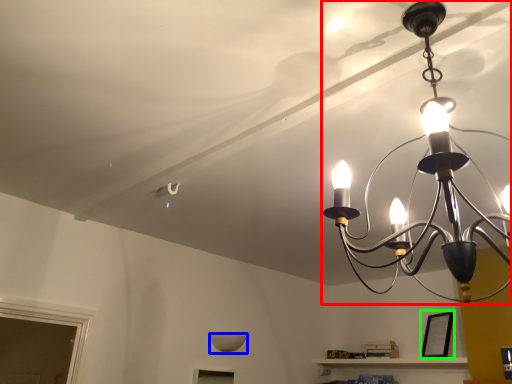
Question: Estimate the real-world distances between objects in this image. Which object is closer to lamp (highlighted by a red box), lamp (highlighted by a blue box) or picture frame (highlighted by a green box)?

Choices:
 (A) lamp
 (B) picture frame

Answer: (B)